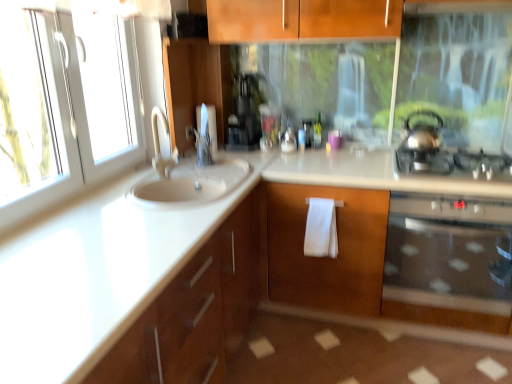
The image size is (512, 384). What do you see at coordinates (321, 229) in the screenshot?
I see `white cotton bath towel at center` at bounding box center [321, 229].

Measure the distance between point (x=208, y=133) and camera.

Point (x=208, y=133) and camera are 7.96 feet apart.

Find the location of a particular element. white glossy sink at left is located at coordinates (93, 277).

You are a GUI agent. You are given a task and a screenshot of the screen. Output one action in this format:
    pyautogui.click(x=<x>, y=<y>)
    Task: Click on the shiny metallic kettle at right
    The height and width of the screenshot is (384, 512).
    Given the screenshot: What is the action you would take?
    pyautogui.click(x=423, y=134)

Where is `satin silver gas stove at right`? This screenshot has width=512, height=384. satin silver gas stove at right is located at coordinates (455, 164).

From the image's perspective, does satin silver gas stove at right appear lower than stainless steel oven at right?

Incorrect, from the image's perspective, satin silver gas stove at right is higher than stainless steel oven at right.

In terms of size, does satin silver gas stove at right appear bigger or smaller than stainless steel oven at right?

Clearly, satin silver gas stove at right is smaller in size than stainless steel oven at right.

Looking at this image, is satin silver gas stove at right looking in the opposite direction of stainless steel oven at right?

No, satin silver gas stove at right is not facing the opposite direction of stainless steel oven at right.

From a real-world perspective, which object stands above the other?

From a 3D spatial view, stainless steel oven at right is above.

Considering the relative sizes of white glossy sink at left and stainless steel oven at right in the image provided, is white glossy sink at left smaller than stainless steel oven at right?

No.

Who is taller, white glossy sink at left or stainless steel oven at right?

white glossy sink at left is taller.

Looking at this image, is white glossy sink at left in contact with stainless steel oven at right?

No, white glossy sink at left is not touching stainless steel oven at right.

Is shiny metallic kettle at right wider than white glossy toilet paper at upper center?

Indeed, shiny metallic kettle at right has a greater width compared to white glossy toilet paper at upper center.

Looking at this image, is shiny metallic kettle at right behind white glossy toilet paper at upper center?

No, it is in front of white glossy toilet paper at upper center.

From a real-world perspective, is shiny metallic kettle at right above or below white glossy toilet paper at upper center?

shiny metallic kettle at right is situated higher than white glossy toilet paper at upper center in the real world.

Between shiny metallic kettle at right and white glossy toilet paper at upper center, which one has less height?

Standing shorter between the two is shiny metallic kettle at right.

Who is shorter, white cotton bath towel at center or satin silver gas stove at right?

Standing shorter between the two is satin silver gas stove at right.

Looking at this image, between white cotton bath towel at center and satin silver gas stove at right, which one appears on the right side from the viewer's perspective?

satin silver gas stove at right.

Is white cotton bath towel at center behind satin silver gas stove at right?

Yes, white cotton bath towel at center is behind satin silver gas stove at right.

Is point (12, 263) positioned before point (211, 130)?

Yes, point (12, 263) is in front of point (211, 130).

Who is bigger, white glossy sink at left or white glossy toilet paper at upper center?

white glossy sink at left.

Is white glossy sink at left to the left of white glossy toilet paper at upper center from the viewer's perspective?

Indeed, white glossy sink at left is positioned on the left side of white glossy toilet paper at upper center.

Is white glossy sink at left facing away from white glossy toilet paper at upper center?

No, white glossy sink at left's orientation is not away from white glossy toilet paper at upper center.

Based on the photo, from the image's perspective, would you say white glossy sink at left is shown under satin silver gas stove at right?

Correct, white glossy sink at left appears lower than satin silver gas stove at right in the image.

Considering their positions, is white glossy sink at left located in front of or behind satin silver gas stove at right?

Clearly, white glossy sink at left is in front of satin silver gas stove at right.

Would you say white glossy sink at left is a long distance from satin silver gas stove at right?

No, white glossy sink at left is not far from satin silver gas stove at right.

Is white glossy sink at left taller than satin silver gas stove at right?

Indeed, white glossy sink at left has a greater height compared to satin silver gas stove at right.

In terms of height, does white glossy toilet paper at upper center look taller or shorter compared to stainless steel oven at right?

In the image, white glossy toilet paper at upper center appears to be shorter than stainless steel oven at right.

Does point (211, 146) come behind point (393, 197)?

Yes, it is behind point (393, 197).

Is stainless steel oven at right a part of white glossy toilet paper at upper center?

Actually, stainless steel oven at right is outside white glossy toilet paper at upper center.

Is the position of white glossy toilet paper at upper center more distant than that of stainless steel oven at right?

Yes.

Where is `gas stove above the stainless steel oven at right (from a real-world perspective)`? gas stove above the stainless steel oven at right (from a real-world perspective) is located at coordinates (455, 164).

The height and width of the screenshot is (384, 512). In the image, there is a stainless steel oven at right. Find the location of `countertop below it (from the image's perspective)`. countertop below it (from the image's perspective) is located at coordinates (93, 277).

When comparing their distances from stainless steel oven at right, does white glossy toilet paper at upper center or white cotton bath towel at center seem further?

Among the two, white glossy toilet paper at upper center is located further to stainless steel oven at right.

When comparing their distances from stainless steel oven at right, does white glossy sink at left or white glossy toilet paper at upper center seem closer?

Based on the image, white glossy sink at left appears to be nearer to stainless steel oven at right.

Consider the image. Estimate the real-world distances between objects in this image. Which object is further from white glossy toilet paper at upper center, satin silver gas stove at right or stainless steel oven at right?

Based on the image, stainless steel oven at right appears to be further to white glossy toilet paper at upper center.

Based on the photo, from the image, which object appears to be nearer to white glossy toilet paper at upper center, satin silver gas stove at right or white cotton bath towel at center?

The object closer to white glossy toilet paper at upper center is white cotton bath towel at center.

From the image, which object appears to be farther from stainless steel oven at right, shiny metallic kettle at right or white glossy sink at left?

Among the two, white glossy sink at left is located further to stainless steel oven at right.

Considering their positions, is shiny metallic kettle at right positioned closer to satin silver gas stove at right than white glossy toilet paper at upper center?

Among the two, shiny metallic kettle at right is located nearer to satin silver gas stove at right.

From the image, which object appears to be nearer to white glossy sink at left, shiny metallic kettle at right or stainless steel oven at right?

Based on the image, stainless steel oven at right appears to be nearer to white glossy sink at left.

Considering their positions, is white glossy sink at left positioned closer to stainless steel oven at right than shiny metallic kettle at right?

shiny metallic kettle at right.

This screenshot has width=512, height=384. Identify the location of tea pot between white cotton bath towel at center and stainless steel oven at right in the horizontal direction. (423, 134).

Locate an element on the screen. bath towel between white glossy sink at left and stainless steel oven at right from left to right is located at coordinates (321, 229).

You are a GUI agent. You are given a task and a screenshot of the screen. Output one action in this format:
    pyautogui.click(x=<x>, y=<y>)
    Task: Click on the tea pot located between white glossy sink at left and white glossy toilet paper at upper center in the depth direction
    The image size is (512, 384).
    Given the screenshot: What is the action you would take?
    pyautogui.click(x=423, y=134)

This screenshot has width=512, height=384. I want to click on bath towel between white glossy toilet paper at upper center and stainless steel oven at right, so click(321, 229).